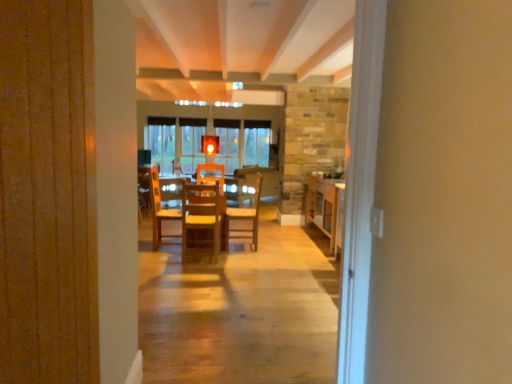
Question: Does wooden table at right, which ranks as the 1th table in right-to-left order, have a greater height compared to wooden chair at center, which is counted as the 2th chair, starting from the front?

Choices:
 (A) yes
 (B) no

Answer: (B)

Question: Is wooden table at right, which ranks as the 1th table in right-to-left order, shorter than wooden chair at center, which appears as the first chair when viewed from the right?

Choices:
 (A) no
 (B) yes

Answer: (B)

Question: From the image's perspective, is wooden table at right, the second table viewed from the left, below wooden chair at center, which appears as the first chair when viewed from the right?

Choices:
 (A) no
 (B) yes

Answer: (A)

Question: Are wooden table at right, which ranks as the 1th table in right-to-left order, and wooden chair at center, which appears as the first chair when viewed from the right, far apart?

Choices:
 (A) no
 (B) yes

Answer: (B)

Question: Does wooden table at right, which ranks as the 1th table in right-to-left order, contain wooden chair at center, which is the second chair in left-to-right order?

Choices:
 (A) yes
 (B) no

Answer: (B)

Question: Is wooden chair at center, which ranks as the 1th chair in front-to-back order, to the left or to the right of wooden chair at center, which appears as the first chair when viewed from the back, in the image?

Choices:
 (A) right
 (B) left

Answer: (B)

Question: Would you say wooden chair at center, placed as the 2th chair when sorted from back to front, is inside or outside wooden chair at center, which is the second chair in left-to-right order?

Choices:
 (A) outside
 (B) inside

Answer: (A)

Question: Is wooden chair at center, placed as the 2th chair when sorted from back to front, in front of or behind wooden chair at center, which is counted as the 2th chair, starting from the front, in the image?

Choices:
 (A) front
 (B) behind

Answer: (A)

Question: From the image's perspective, is wooden chair at center, which ranks as the 1th chair in front-to-back order, positioned above or below wooden chair at center, which appears as the first chair when viewed from the back?

Choices:
 (A) below
 (B) above

Answer: (A)

Question: Considering the positions of wooden table at center, the second table viewed from the right, and wooden chair at center, which appears as the first chair when viewed from the right, in the image, is wooden table at center, the second table viewed from the right, taller or shorter than wooden chair at center, which appears as the first chair when viewed from the right,?

Choices:
 (A) tall
 (B) short

Answer: (B)

Question: Is point (183, 180) positioned closer to the camera than point (224, 248)?

Choices:
 (A) farther
 (B) closer

Answer: (B)

Question: Do you think wooden table at center, the second table viewed from the right, is within wooden chair at center, which is the second chair in left-to-right order, or outside of it?

Choices:
 (A) outside
 (B) inside

Answer: (A)

Question: In terms of size, does wooden table at center, arranged as the first table when viewed from the left, appear bigger or smaller than wooden chair at center, which appears as the first chair when viewed from the right?

Choices:
 (A) small
 (B) big

Answer: (B)

Question: Is wooden table at right, the second table viewed from the left, inside or outside of wooden chair at center, arranged as the second chair when viewed from the right?

Choices:
 (A) inside
 (B) outside

Answer: (B)

Question: In terms of height, does wooden table at right, which ranks as the 1th table in right-to-left order, look taller or shorter compared to wooden chair at center, which ranks as the 1th chair in front-to-back order?

Choices:
 (A) tall
 (B) short

Answer: (A)